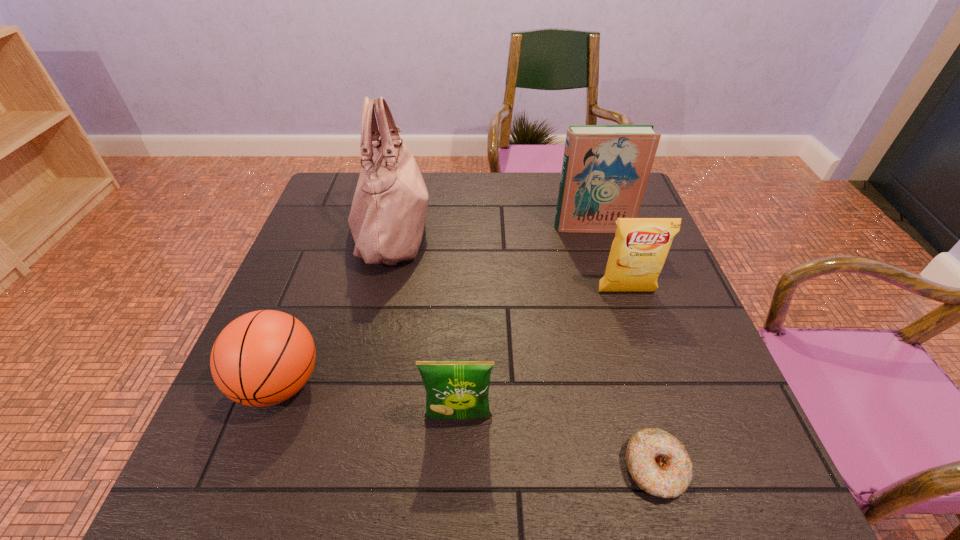
Locate an element on the screen. crisp (potato chip) located in the right edge section of the desktop is located at coordinates (640, 247).

Locate an element on the screen. doughnut at the right edge is located at coordinates (658, 462).

At what (x,y) coordinates should I click in order to perform the action: click on object positioned at the far left corner. Please return your answer as a coordinate pair (x, y). Looking at the image, I should click on (388, 213).

Where is `object that is at the near right corner`? This screenshot has height=540, width=960. object that is at the near right corner is located at coordinates (658, 462).

The width and height of the screenshot is (960, 540). In the image, there is a desktop. What are the coordinates of `vacant region at the far edge` in the screenshot? It's located at (527, 179).

The width and height of the screenshot is (960, 540). In order to click on vacant space at the near edge of the desktop in this screenshot , I will do `click(291, 469)`.

This screenshot has height=540, width=960. I want to click on free space at the left edge, so click(294, 259).

In the image, there is a desktop. Where is `vacant space at the right edge`? vacant space at the right edge is located at coordinates (656, 303).

You are a GUI agent. You are given a task and a screenshot of the screen. Output one action in this format:
    pyautogui.click(x=<x>, y=<y>)
    Task: Click on the vacant region at the far left corner of the desktop
    This screenshot has height=540, width=960.
    Given the screenshot: What is the action you would take?
    pyautogui.click(x=324, y=194)

In the image, there is a desktop. Where is `vacant space at the near right corner`? vacant space at the near right corner is located at coordinates (721, 478).